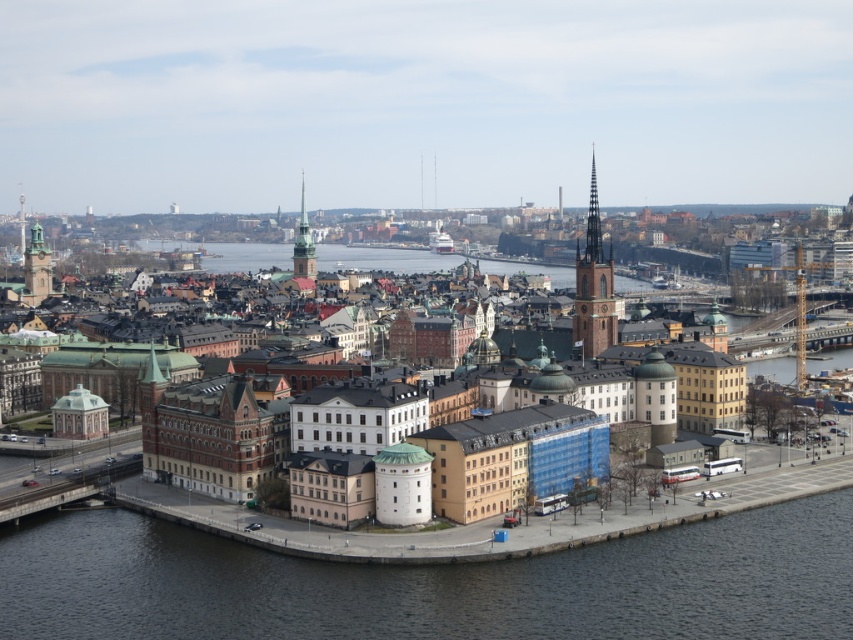
Consider the image. You are standing at the viewpoint overlooking the city. There are two points marked in the scene, one at coordinates point (612, 296) and another at point (38, 300). Which point is closer to your current position?

Point (612, 296) is closer to the camera than point (38, 300), so the point at coordinates point (612, 296) is closer to your current position.

You are a tourist standing at the point with coordinates point (433, 584). You want to take a photo of the dark gray water at lower center. Is the dark gray water at lower center visible from your current position?

The point (433, 584) corresponds to the dark gray water at lower center, so yes, the dark gray water at lower center is visible from your current position.

Based on the photo, you are a tourist standing at the waterfront in Stockholm, Sweden. You see two points marked on a map as point 1 at coordinates point (672,584) and point 2 at coordinates point (587,326). Which point is closer to you when you are facing the waterfront?

Point (672,584) is in front of point (587,326), so point (672,584) is closer to you when facing the waterfront.